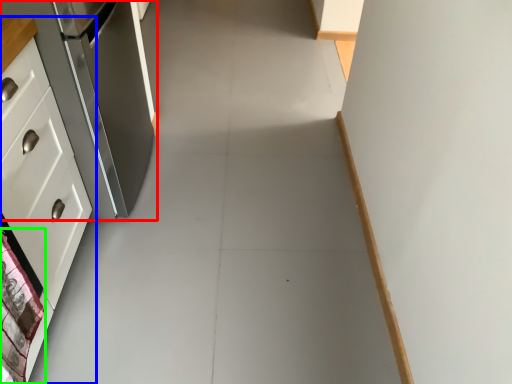
Question: Estimate the real-world distances between objects in this image. Which object is closer to refrigerator (highlighted by a red box), cabinetry (highlighted by a blue box) or material (highlighted by a green box)?

Choices:
 (A) cabinetry
 (B) material

Answer: (A)